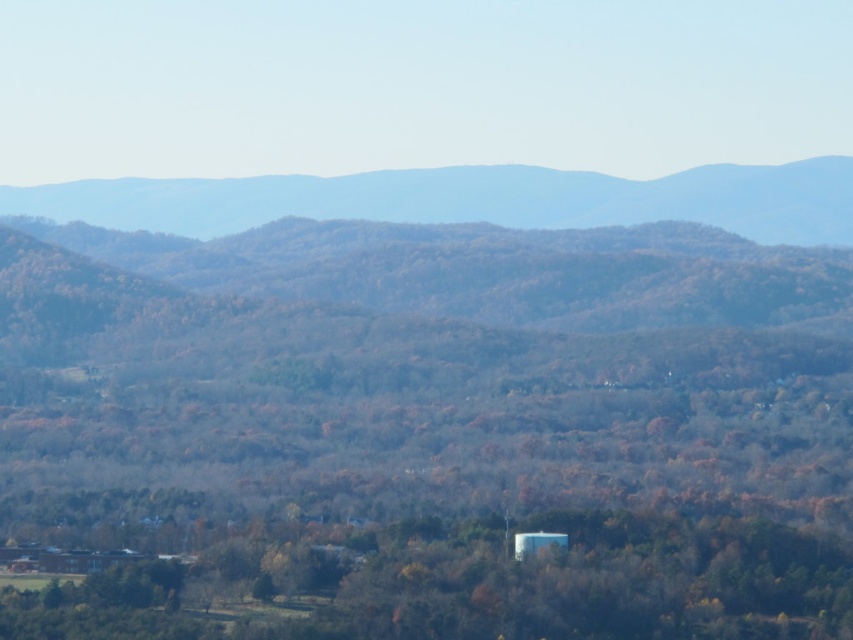
Question: Does green matte tree at center come behind greenish-brown forested mountain at upper center?

Choices:
 (A) yes
 (B) no

Answer: (B)

Question: Does green matte tree at center appear under greenish-brown forested mountain at upper center?

Choices:
 (A) no
 (B) yes

Answer: (B)

Question: Is green matte tree at center smaller than greenish-brown forested mountain at upper center?

Choices:
 (A) yes
 (B) no

Answer: (B)

Question: Which object is farther from the camera taking this photo?

Choices:
 (A) green matte tree at center
 (B) greenish-brown forested mountain at upper center

Answer: (B)

Question: Which point appears closest to the camera in this image?

Choices:
 (A) (550, 173)
 (B) (570, 516)

Answer: (B)